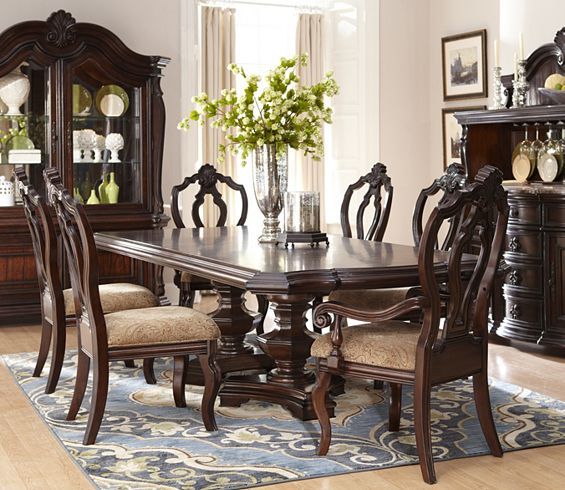
Where is `fragile glass`? The height and width of the screenshot is (490, 565). fragile glass is located at coordinates (272, 184), (308, 211), (529, 144), (541, 145), (558, 145), (24, 137).